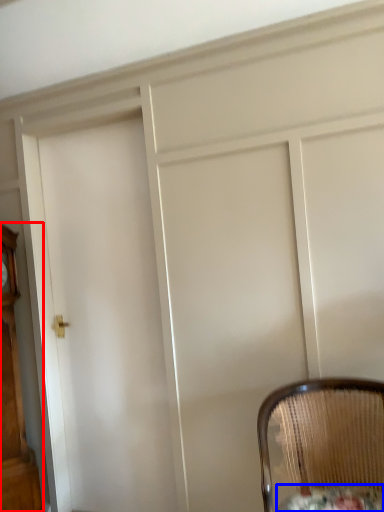
Question: Which object is further to the camera taking this photo, furniture (highlighted by a red box) or round table (highlighted by a blue box)?

Choices:
 (A) furniture
 (B) round table

Answer: (A)